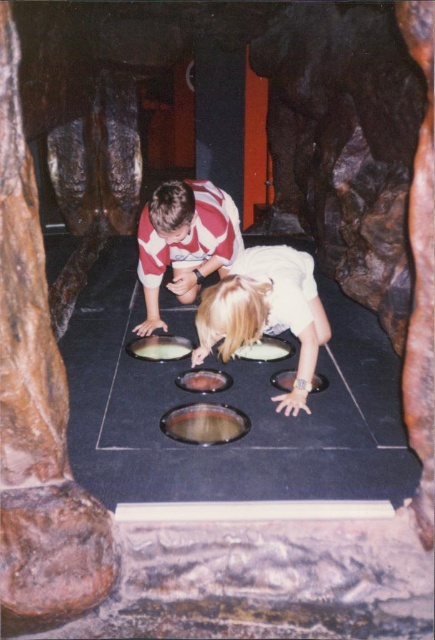
Question: Can you confirm if brown matte food at center is smaller than matte plastic food at center?

Choices:
 (A) no
 (B) yes

Answer: (B)

Question: Based on their relative distances, which object is farther from the white matte shirt at center?

Choices:
 (A) white creamy food at center
 (B) brown matte food at center
 (C) striped jersey at center
 (D) matte plastic food at center

Answer: (C)

Question: Is striped jersey at center positioned before matte plastic food at center?

Choices:
 (A) yes
 (B) no

Answer: (A)

Question: Is white matte shirt at center further to camera compared to white matte food at center?

Choices:
 (A) no
 (B) yes

Answer: (A)

Question: Estimate the real-world distances between objects in this image. Which object is closer to the matte plastic food at center?

Choices:
 (A) white creamy food at center
 (B) white matte shirt at center
 (C) white matte food at center

Answer: (A)

Question: Which object is the closest to the matte plastic food at center?

Choices:
 (A) brown matte food at center
 (B) white creamy food at center

Answer: (B)